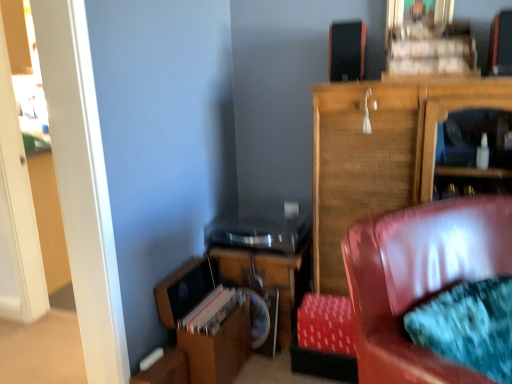
Question: Is wooden table at lower center further to the viewer compared to black matte speaker at upper center?

Choices:
 (A) no
 (B) yes

Answer: (B)

Question: Is wooden table at lower center to the left of black matte speaker at upper center from the viewer's perspective?

Choices:
 (A) yes
 (B) no

Answer: (A)

Question: From the image's perspective, is wooden table at lower center under black matte speaker at upper center?

Choices:
 (A) no
 (B) yes

Answer: (B)

Question: Is wooden table at lower center surrounding black matte speaker at upper center?

Choices:
 (A) no
 (B) yes

Answer: (A)

Question: Considering the relative sizes of wooden table at lower center and black matte speaker at upper center in the image provided, is wooden table at lower center taller than black matte speaker at upper center?

Choices:
 (A) yes
 (B) no

Answer: (A)

Question: From a real-world perspective, is wooden table at lower center over black matte speaker at upper center?

Choices:
 (A) yes
 (B) no

Answer: (B)

Question: From the image's perspective, is wooden table at lower center located above leather couch at lower right?

Choices:
 (A) yes
 (B) no

Answer: (B)

Question: Does wooden table at lower center appear on the right side of leather couch at lower right?

Choices:
 (A) no
 (B) yes

Answer: (A)

Question: Does wooden table at lower center have a lesser width compared to leather couch at lower right?

Choices:
 (A) yes
 (B) no

Answer: (A)

Question: Is wooden table at lower center facing towards leather couch at lower right?

Choices:
 (A) no
 (B) yes

Answer: (A)

Question: Is wooden table at lower center further to camera compared to leather couch at lower right?

Choices:
 (A) no
 (B) yes

Answer: (B)

Question: From the image's perspective, does wooden table at lower center appear lower than leather couch at lower right?

Choices:
 (A) no
 (B) yes

Answer: (B)

Question: From a real-world perspective, is wooden table at lower center below wooden cabinet at upper right?

Choices:
 (A) no
 (B) yes

Answer: (B)